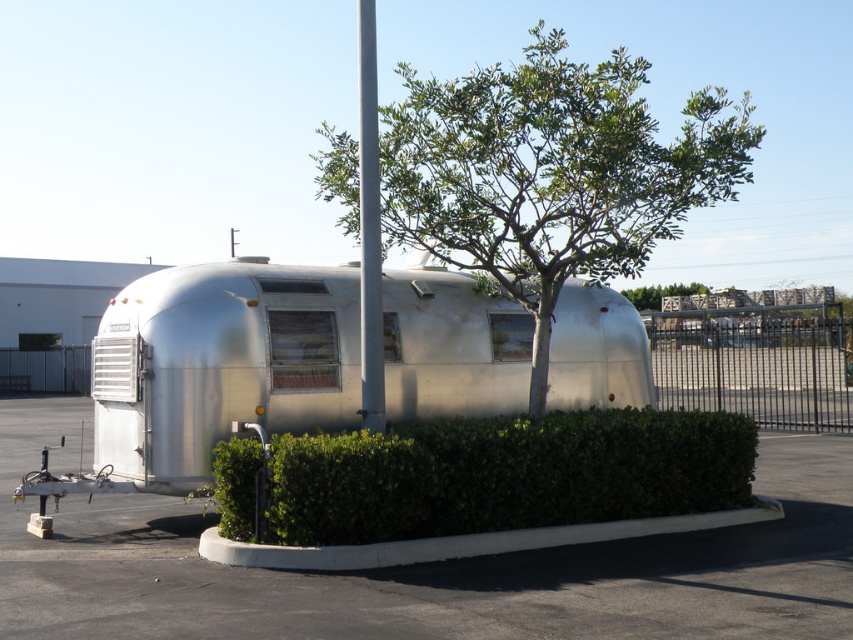
Which of these two, green leafy tree at center or white glossy pole at center, stands shorter?

Standing shorter between the two is white glossy pole at center.

The width and height of the screenshot is (853, 640). What do you see at coordinates (532, 172) in the screenshot?
I see `green leafy tree at center` at bounding box center [532, 172].

This screenshot has width=853, height=640. In order to click on green leafy tree at center in this screenshot , I will do `click(532, 172)`.

Can you confirm if green hedge at center is positioned below green leafy tree at center?

Yes, green hedge at center is below green leafy tree at center.

Is green hedge at center above green leafy tree at center?

No.

The width and height of the screenshot is (853, 640). What are the coordinates of `green hedge at center` in the screenshot? It's located at (422, 566).

Between green hedge at center and silver metallic trailer at center, which one appears on the right side from the viewer's perspective?

green hedge at center is more to the right.

Consider the image. Can you confirm if green hedge at center is positioned above silver metallic trailer at center?

Incorrect, green hedge at center is not positioned above silver metallic trailer at center.

What are the coordinates of `green hedge at center` in the screenshot? It's located at tap(422, 566).